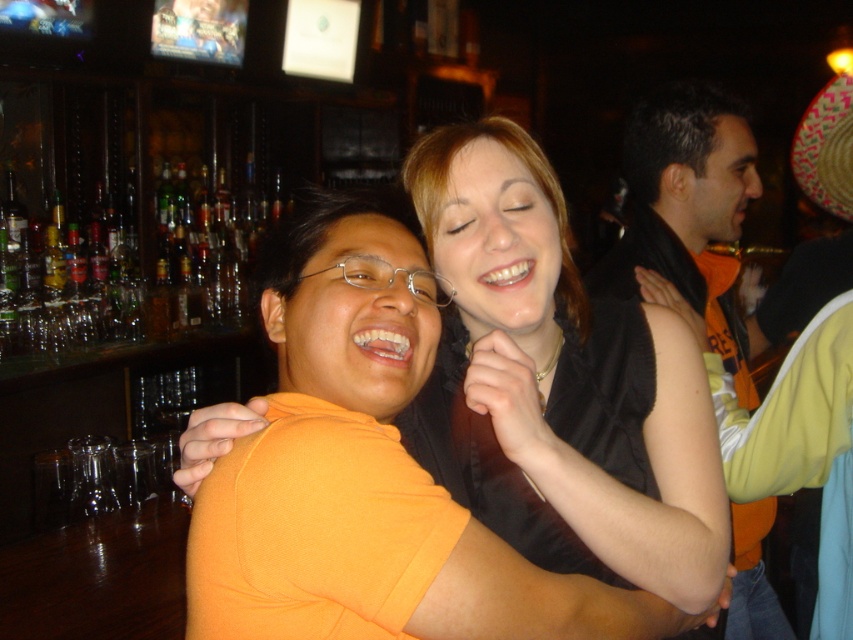
Question: Is black sleeveless shirt at right smaller than patterned straw hat at upper right?

Choices:
 (A) yes
 (B) no

Answer: (B)

Question: In this image, where is black sleeveless shirt at right located relative to patterned straw hat at upper right?

Choices:
 (A) above
 (B) below

Answer: (B)

Question: Which of these objects is positioned farthest from the orange matte shirt at center?

Choices:
 (A) patterned straw hat at upper right
 (B) black sleeveless shirt at right

Answer: (A)

Question: Among these points, which one is farthest from the camera?

Choices:
 (A) (521, 236)
 (B) (753, 595)
 (C) (828, 116)

Answer: (B)

Question: Which point is farther from the camera taking this photo?

Choices:
 (A) (634, 285)
 (B) (785, 632)
 (C) (846, 168)

Answer: (A)

Question: From the image, what is the correct spatial relationship of orange matte shirt at center in relation to patterned straw hat at upper right?

Choices:
 (A) below
 (B) above

Answer: (A)